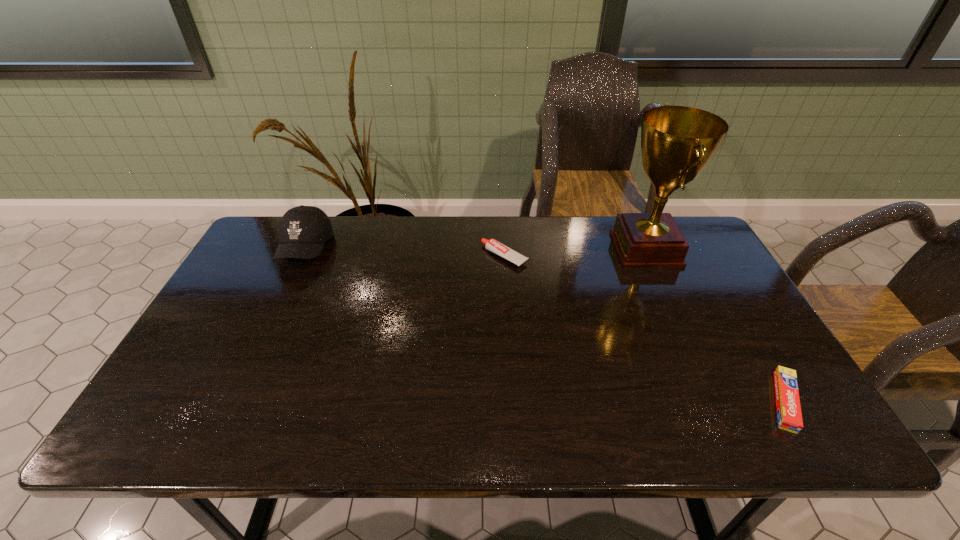
You are a GUI agent. You are given a task and a screenshot of the screen. Output one action in this format:
    pyautogui.click(x=<x>, y=<y>)
    Task: Click on the toothpaste positioned at the right edge
    This screenshot has height=540, width=960.
    Given the screenshot: What is the action you would take?
    pyautogui.click(x=789, y=415)

This screenshot has height=540, width=960. I want to click on object located at the far left corner, so click(303, 230).

I want to click on object that is at the far right corner, so click(677, 142).

I want to click on object located at the near right corner, so click(789, 415).

The height and width of the screenshot is (540, 960). I want to click on vacant point at the far edge, so click(x=371, y=242).

The height and width of the screenshot is (540, 960). In the image, there is a desktop. In order to click on free space at the near edge in this screenshot , I will do `click(721, 411)`.

This screenshot has height=540, width=960. Find the location of `vacant position at the left edge of the desktop`. vacant position at the left edge of the desktop is located at coordinates (197, 349).

In the image, there is a desktop. Identify the location of vacant region at the right edge. (749, 349).

Identify the location of vacant space at the near right corner of the desktop. (800, 438).

The image size is (960, 540). I want to click on vacant space that is in between the left toothpaste and the third object from left to right, so click(575, 253).